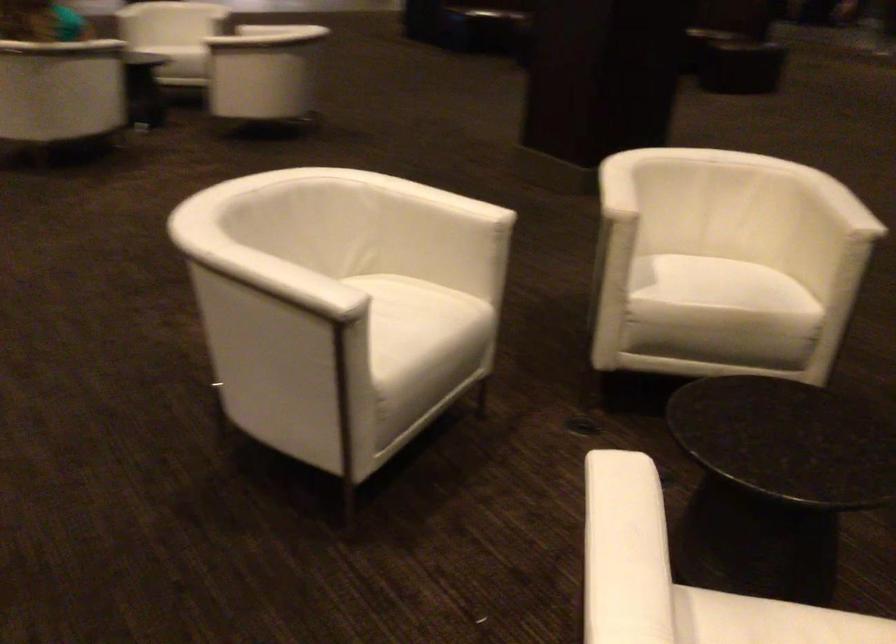
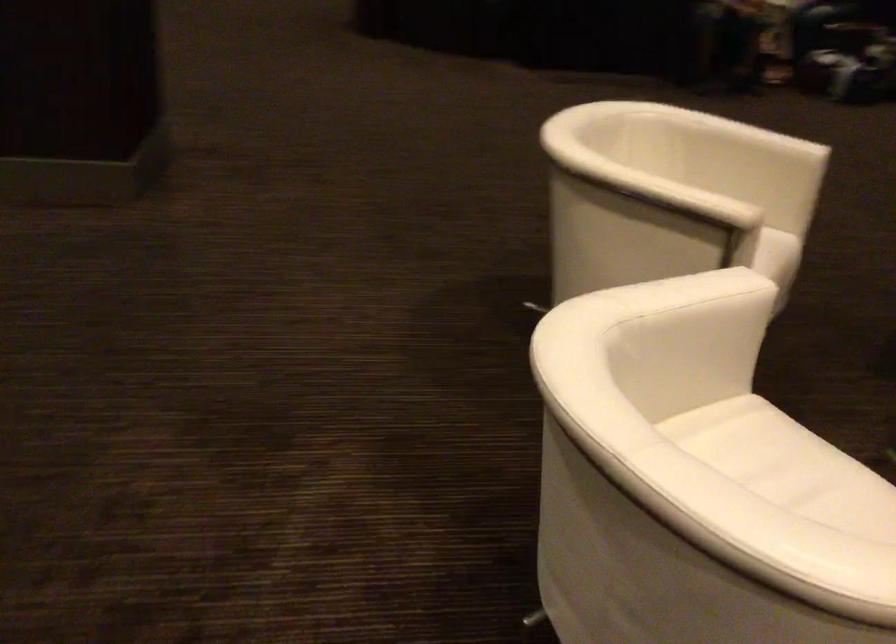
Find the pixel in the second image that matches [402,301] in the first image.

(767, 453)